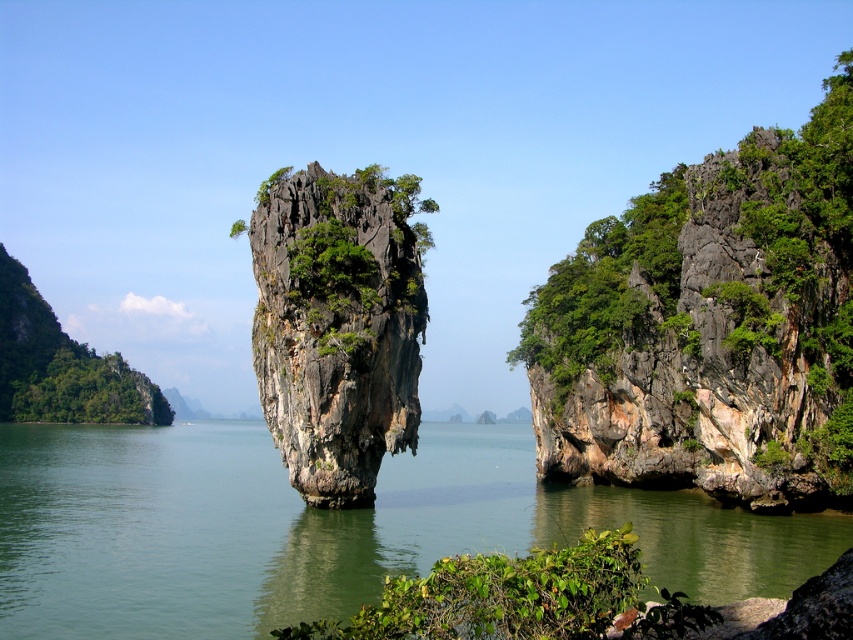
You are a boat captain navigating near James Bond Island. You spot the green rough rock at right and the rugged stone rock at center. How far apart are these two rocks?

The green rough rock at right is 29.19 meters from the rugged stone rock at center, so the distance between them is 29.19 meters.

You are standing at the viewpoint overlooking James Bond Island. You notice two points marked on the image. The first point is labeled as point (376, 412) and the second is point (578, 616). Which of these two points is closer to the front of the image?

Point (578, 616) is closer to the front of the image because it is in front of point (376, 412) according to the description.

You are standing on the dock looking at the green rough rock at right and the green leafy tree at left. Which object is positioned higher in the scene?

The green rough rock at right is positioned higher than the green leafy tree at left according to the description.